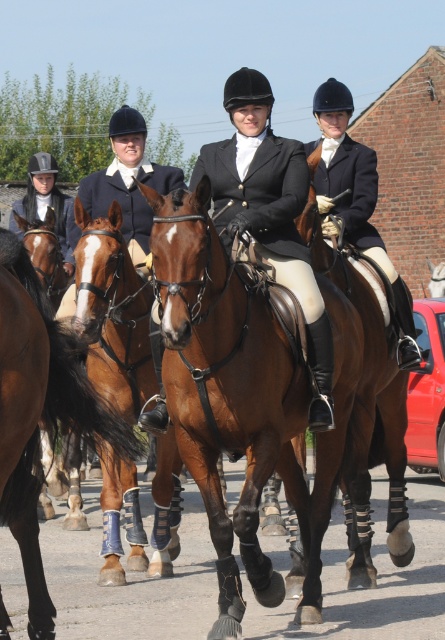
You are a photographer standing at the starting line of an equestrian event. You want to take a closeup shot of the brown glossy horse at center. The camera you have can focus on subjects within 5 meters. Can you capture a clear closeup without moving closer?

The brown glossy horse at center is 6.54 meters away from the camera. Since the camera can only focus within 5 meters, you cannot capture a clear closeup without moving closer.